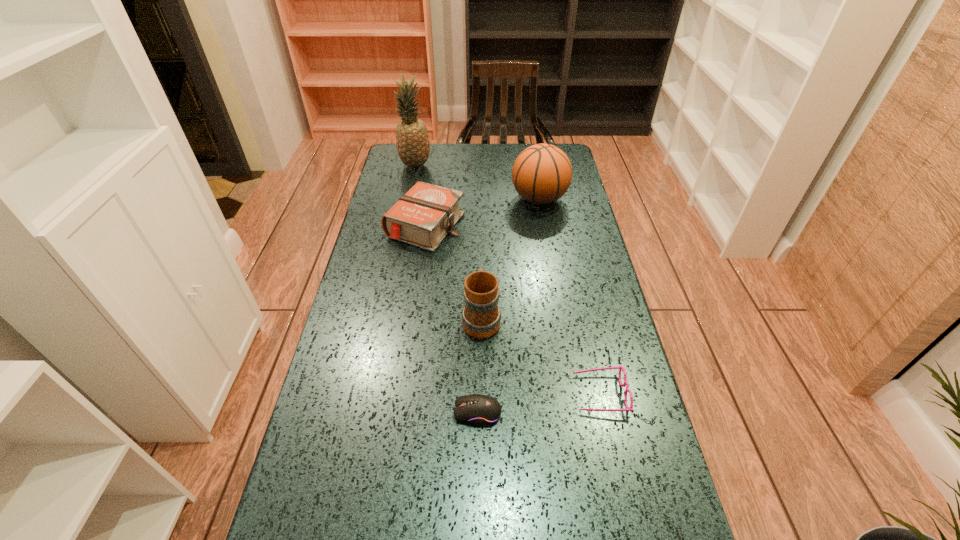
Find the location of a particular element. free space that is in between the spectacles and the third shortest object is located at coordinates (513, 310).

Identify the location of vacant point located between the fourth tallest object and the computer mouse. The height and width of the screenshot is (540, 960). (451, 319).

At what (x,y) coordinates should I click in order to perform the action: click on vacant space in between the Bible and the computer mouse. Please return your answer as a coordinate pair (x, y). The image size is (960, 540). Looking at the image, I should click on coord(451,319).

Image resolution: width=960 pixels, height=540 pixels. In order to click on vacant area that lies between the spectacles and the third shortest object in this screenshot , I will do `click(513, 310)`.

Find the location of a particular element. This screenshot has height=540, width=960. object that is the nearest to the fourth shortest object is located at coordinates (482, 410).

Locate which object is the fourth closest to the computer mouse. Please provide its 2D coordinates. Your answer should be formatted as a tuple, i.e. [(x, y)], where the tuple contains the x and y coordinates of a point satisfying the conditions above.

[(542, 173)]

Find the location of `free space that satisfies the following two spatial constraints: 1. on the side of the fifth shortest object with the handle; 2. on the left side of the third nearest object`. free space that satisfies the following two spatial constraints: 1. on the side of the fifth shortest object with the handle; 2. on the left side of the third nearest object is located at coordinates (481, 199).